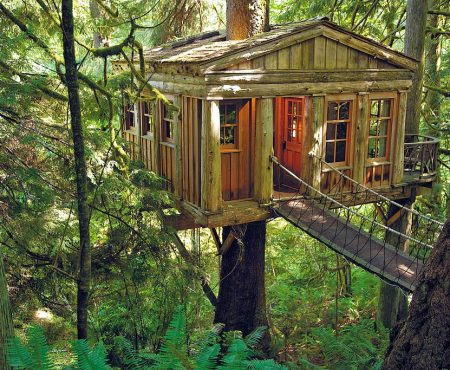
Identify the location of window. Image resolution: width=450 pixels, height=370 pixels. (339, 147).